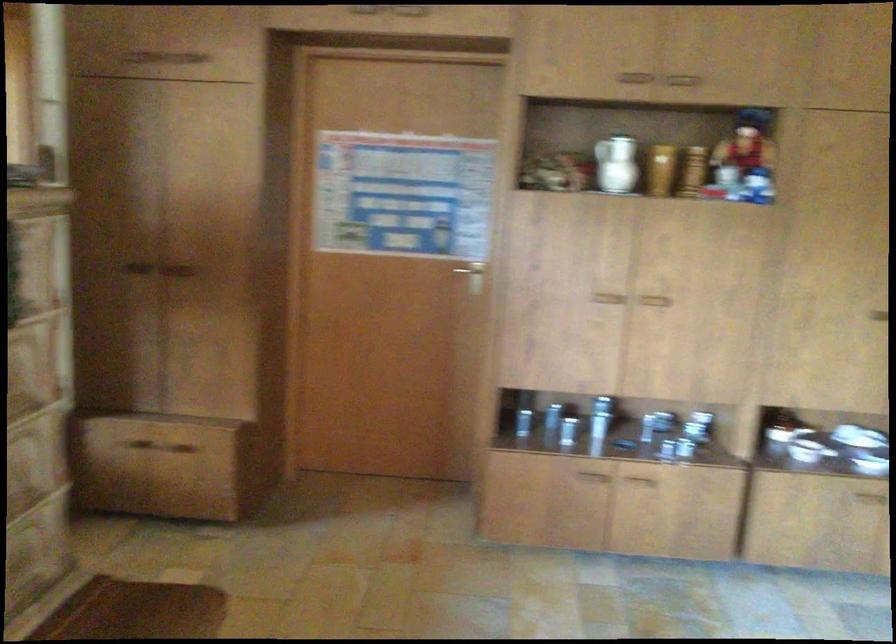
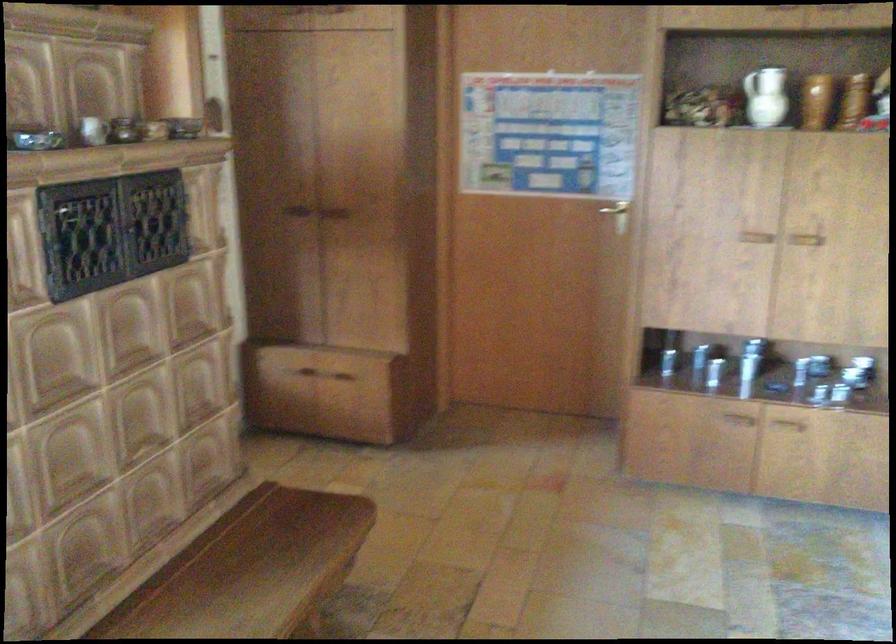
Locate, in the second image, the point that corresponds to point 590,500 in the first image.

(730, 439)